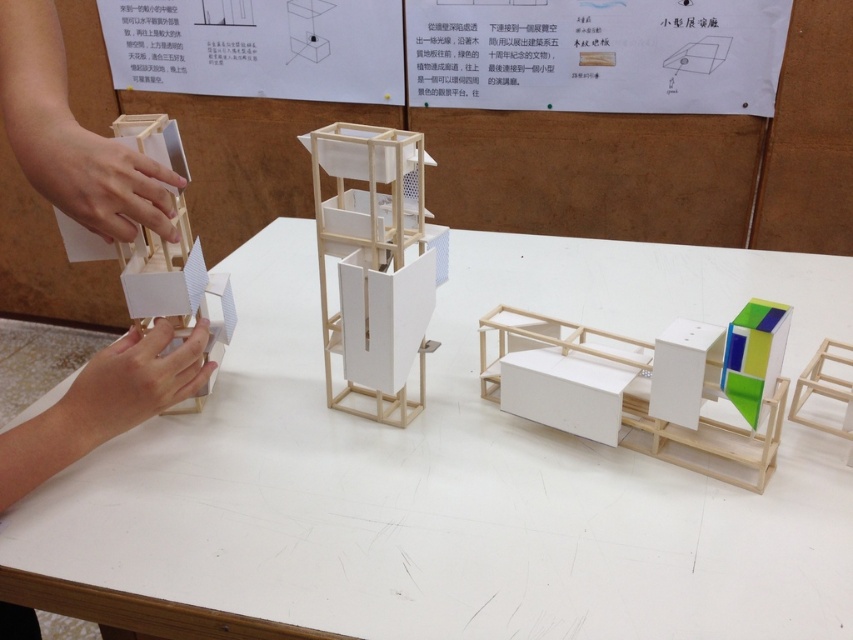
You are standing in front of the white matte table at center and the wooden model at left. Which object is closer to you?

The white matte table at center is closer to you because it is in front of the wooden model at left.

You are an architect visiting an exhibition and notice the white matte table at center and the wooden model at left. Which object would you say occupies more space in the image?

The white matte table at center is larger in size than the wooden model at left, so it occupies more space in the image.

You are an architect examining the display. You need to place a new model that is 1.5 meters wide. Can the white matte table at center accommodate it? Please consider the wooden model at left which is already on the table.

The white matte table at center is wider than the wooden model at left. However, since the table is only wider than the model and not the new model, it is uncertain if the table can accommodate the new 1.5m wide model. More information about the table dimensions is needed.